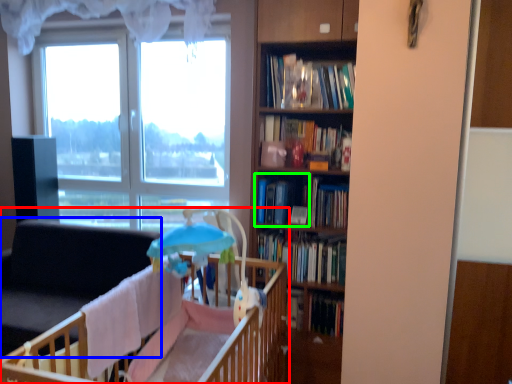
Question: Estimate the real-world distances between objects in this image. Which object is farther from infant bed (highlighted by a red box), swivel chair (highlighted by a blue box) or book (highlighted by a green box)?

Choices:
 (A) swivel chair
 (B) book

Answer: (A)